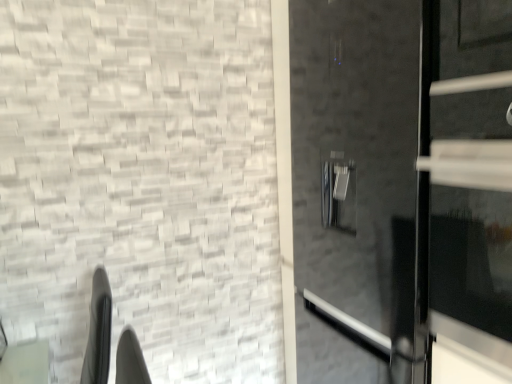
Question: Is the depth of glossy black door at right, which is the 1th door from back to front, less than that of black glass door at right, which is the 1th door from front to back?

Choices:
 (A) yes
 (B) no

Answer: (B)

Question: Can you confirm if glossy black door at right, which is the 1th door from back to front, is thinner than black glass door at right, which is the 1th door from front to back?

Choices:
 (A) no
 (B) yes

Answer: (A)

Question: Is black glass door at right, which is the 1th door from front to back, inside glossy black door at right, which is the 1th door from back to front?

Choices:
 (A) no
 (B) yes

Answer: (B)

Question: Considering the relative positions of glossy black door at right, which is counted as the second door, starting from the front, and black glass door at right, which is the 1th door from front to back, in the image provided, is glossy black door at right, which is counted as the second door, starting from the front, to the right of black glass door at right, which is the 1th door from front to back, from the viewer's perspective?

Choices:
 (A) yes
 (B) no

Answer: (A)

Question: From the image's perspective, does glossy black door at right, which is the 1th door from back to front, appear lower than black glass door at right, the 2th door when ordered from back to front?

Choices:
 (A) yes
 (B) no

Answer: (A)

Question: Considering the relative positions of glossy black door at right, which is the 1th door from back to front, and black glass door at right, which is the 1th door from front to back, in the image provided, is glossy black door at right, which is the 1th door from back to front, behind black glass door at right, which is the 1th door from front to back,?

Choices:
 (A) no
 (B) yes

Answer: (B)

Question: From the image's perspective, is black glass door at right, which is the 1th door from front to back, under glossy black door at right, which is counted as the second door, starting from the front?

Choices:
 (A) no
 (B) yes

Answer: (A)

Question: From a real-world perspective, is black glass door at right, which is the 1th door from front to back, physically above glossy black door at right, which is the 1th door from back to front?

Choices:
 (A) yes
 (B) no

Answer: (A)

Question: Can you confirm if black glass door at right, which is the 1th door from front to back, is taller than glossy black door at right, which is the 1th door from back to front?

Choices:
 (A) yes
 (B) no

Answer: (B)

Question: Is black glass door at right, which is the 1th door from front to back, oriented towards glossy black door at right, which is counted as the second door, starting from the front?

Choices:
 (A) yes
 (B) no

Answer: (A)

Question: From a real-world perspective, is black glass door at right, which is the 1th door from front to back, located beneath glossy black door at right, which is counted as the second door, starting from the front?

Choices:
 (A) yes
 (B) no

Answer: (B)

Question: Considering the relative sizes of black glass door at right, which is the 1th door from front to back, and glossy black door at right, which is the 1th door from back to front, in the image provided, is black glass door at right, which is the 1th door from front to back, smaller than glossy black door at right, which is the 1th door from back to front,?

Choices:
 (A) yes
 (B) no

Answer: (A)

Question: In terms of height, does black glass door at right, which is the 1th door from front to back, look taller or shorter compared to glossy black door at right, which is counted as the second door, starting from the front?

Choices:
 (A) tall
 (B) short

Answer: (B)